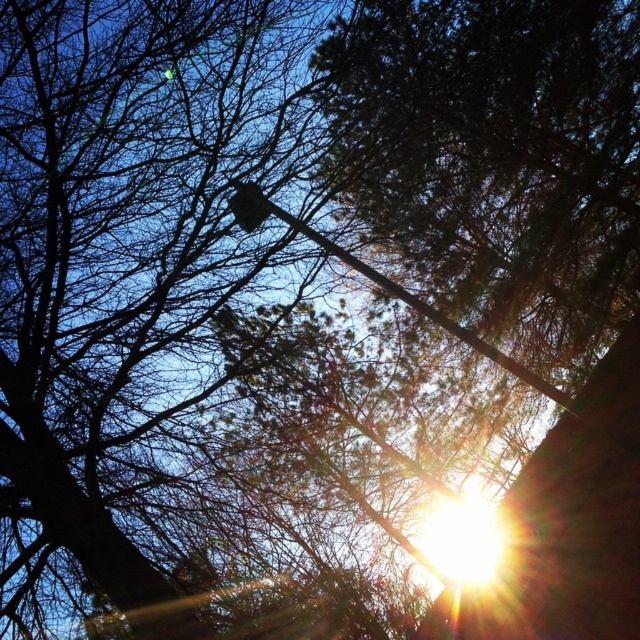
Between bright sun at upper center and metallic gray traffic light at upper center, which one has more height?

bright sun at upper center

Which is behind, point (433, 529) or point (259, 212)?

Positioned behind is point (433, 529).

Locate an element on the screen. bright sun at upper center is located at coordinates (465, 541).

Is bright sun at upper center shorter than smooth metal pole at center?

In fact, bright sun at upper center may be taller than smooth metal pole at center.

Between bright sun at upper center and smooth metal pole at center, which one appears on the left side from the viewer's perspective?

smooth metal pole at center is more to the left.

Is point (461, 576) farther from camera compared to point (451, 323)?

No, it is in front of (451, 323).

The image size is (640, 640). Find the location of `bright sun at upper center`. bright sun at upper center is located at coordinates point(465,541).

Describe the element at coordinates (426, 310) in the screenshot. I see `smooth metal pole at center` at that location.

Locate an element on the screen. Image resolution: width=640 pixels, height=640 pixels. smooth metal pole at center is located at coordinates (426, 310).

This screenshot has width=640, height=640. I want to click on smooth metal pole at center, so click(426, 310).

Find the location of a particular element. The height and width of the screenshot is (640, 640). smooth metal pole at center is located at coordinates (426, 310).